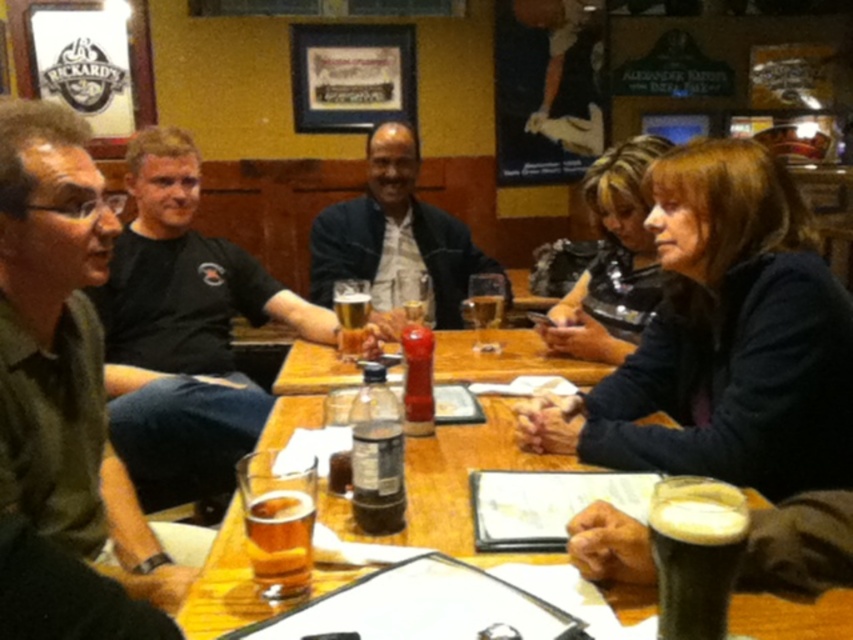
Question: Which object is positioned farthest from the wooden table at center?

Choices:
 (A) dark brown hair at center
 (B) amber glass beer at center
 (C) matte black jacket at center
 (D) foamy dark brown at lower right

Answer: (C)

Question: Which object appears closest to the camera in this image?

Choices:
 (A) translucent glass beer at center
 (B) dark brown hair at center
 (C) green textured shirt at left

Answer: (C)

Question: Which of the following is the farthest from the observer?

Choices:
 (A) denim jacket at center
 (B) foamy dark brown at lower right

Answer: (A)

Question: Does black cotton shirt at left have a smaller size compared to translucent plastic bottle at center?

Choices:
 (A) no
 (B) yes

Answer: (A)

Question: Is green textured shirt at left below amber glass beer at center?

Choices:
 (A) yes
 (B) no

Answer: (B)

Question: Is green textured shirt at left wider than foamy dark brown at lower right?

Choices:
 (A) no
 (B) yes

Answer: (B)